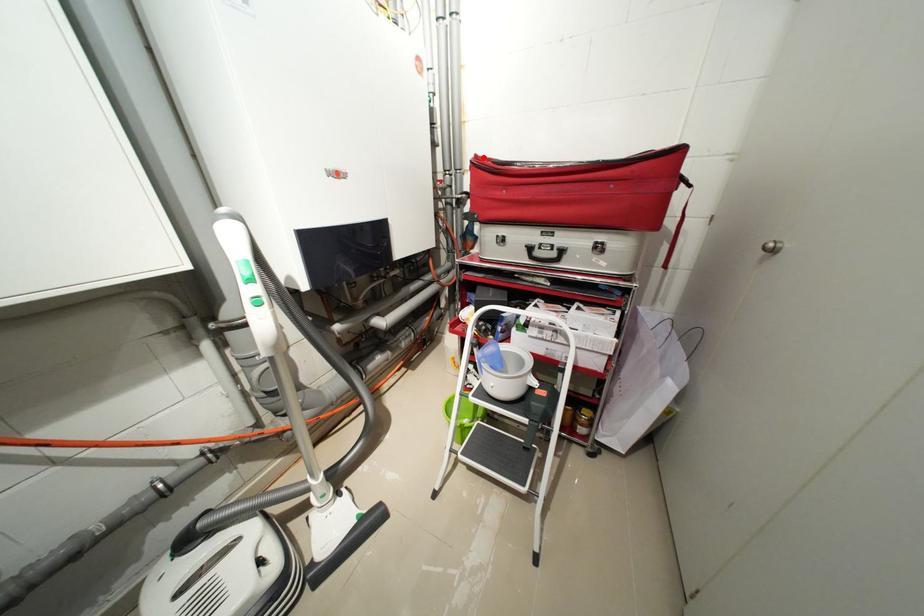
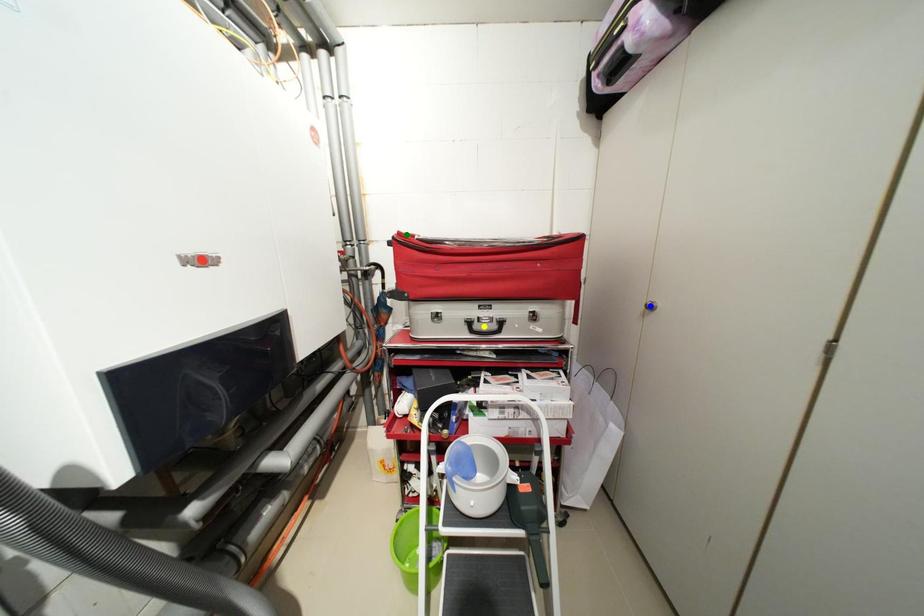
Question: I am providing you with two images of the same scene from different viewpoints. A red point is marked on the first image. You are given multiple points on the second image. Which point in image 2 is actually the same real-world point as the red point in image 1?

Choices:
 (A) yellow point
 (B) green point
 (C) blue point

Answer: (B)